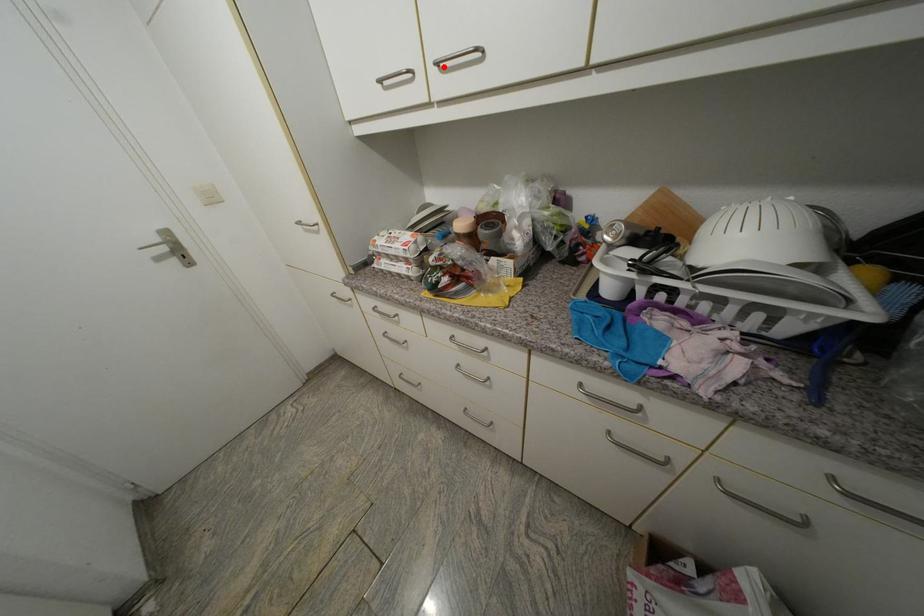
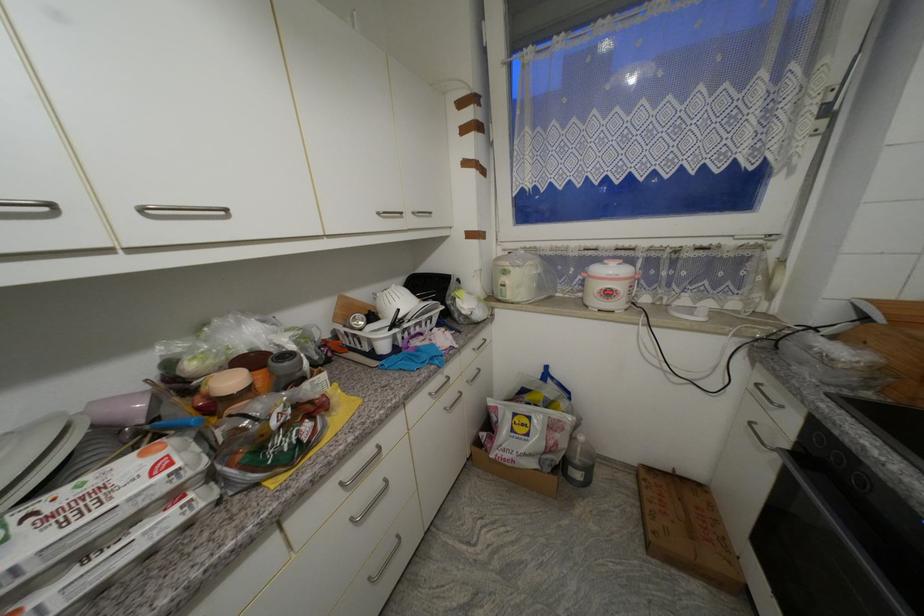
Locate, in the second image, the point that corresponds to the highlighted location in the first image.

(149, 211)